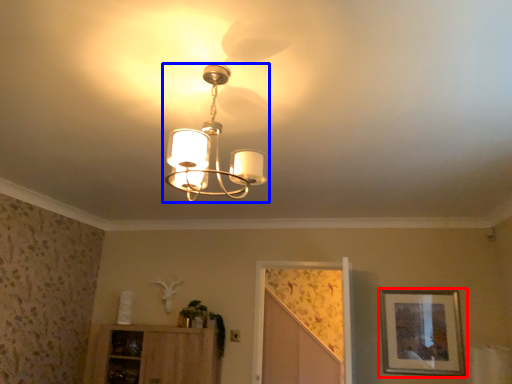
Question: Among these objects, which one is farthest to the camera, picture frame (highlighted by a red box) or lamp (highlighted by a blue box)?

Choices:
 (A) picture frame
 (B) lamp

Answer: (A)